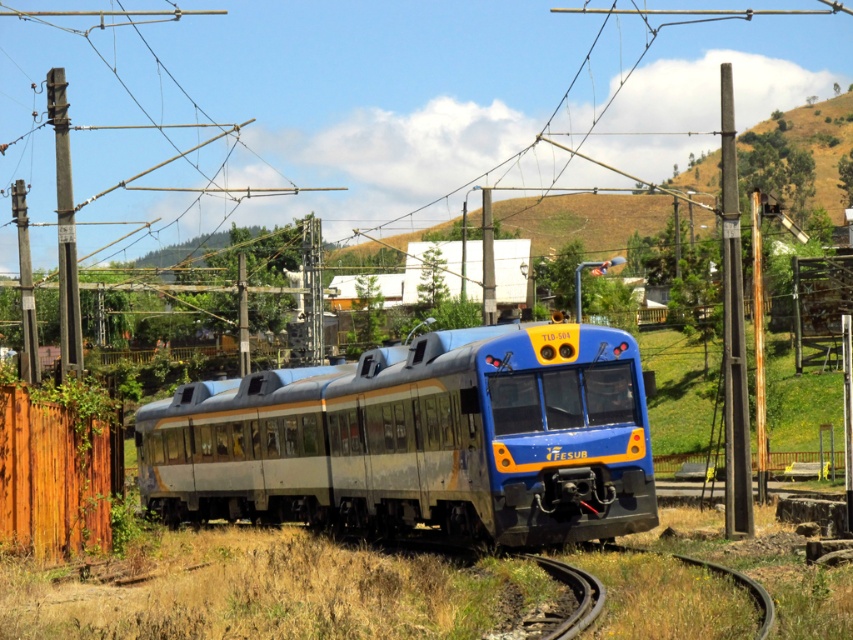
You are standing at the railway station and looking at the train TUS 504. There are two points marked on the train, one at coordinate point [13,477] and another at point [56,202]. Which of these two points is closer to you?

Point [13,477] is closer to you than point [56,202].

You are a photographer standing at the railway station. You want to take a photo of the TUS 504 train with both the brown wooden fence at lower left and the metallic gray pole at left in the frame. Which object should you adjust your camera angle to include first if one is partially out of frame?

The brown wooden fence at lower left is shorter than the metallic gray pole at left. Since the fence is shorter, it might be easier to adjust the camera angle to include it first if it is partially out of frame, as shorter objects can be framed within a narrower angle compared to taller ones.

You are a photographer standing at the railway station. You want to take a photo of the TUS 504 train that includes both the brown wooden fence at lower left and the smooth gray pole at right in the background. Which object will appear shorter in the photo?

The brown wooden fence at lower left will appear shorter in the photo because it is not as tall as the smooth gray pole at right.